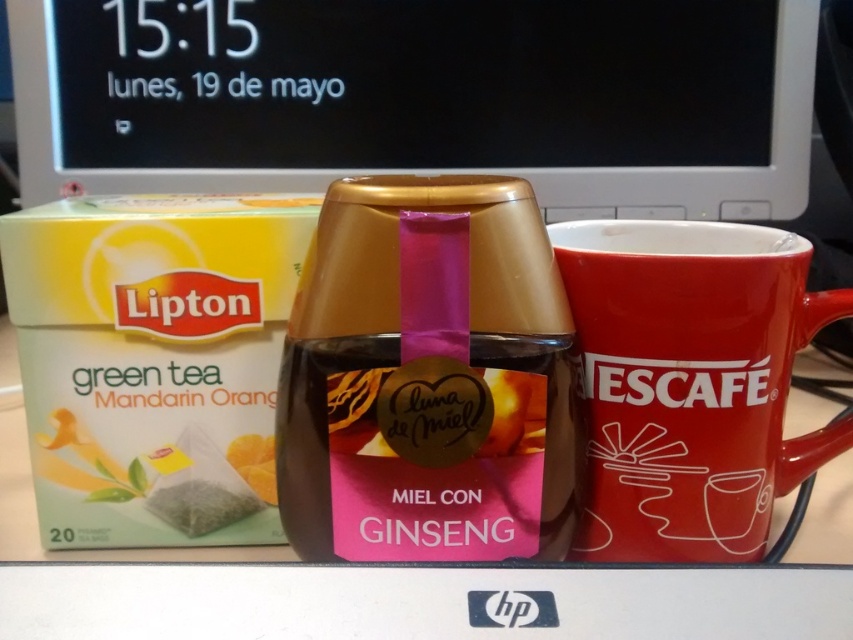
Does matte plastic laptop at upper center have a smaller size compared to pink glossy jar at center?

Answer: No.

Does point (624, 124) lie in front of point (374, 518)?

No, it is behind (374, 518).

Who is more forward, (316, 157) or (550, 305)?

Positioned in front is point (550, 305).

Find the location of a particular element. matte plastic laptop at upper center is located at coordinates (422, 97).

Is matte plastic laptop at upper center taller than red ceramic mug at center?

Correct, matte plastic laptop at upper center is much taller as red ceramic mug at center.

From the picture: Measure the distance from matte plastic laptop at upper center to red ceramic mug at center.

They are 20.40 inches apart.

Between point (27, 132) and point (769, 269), which one is positioned in front?

Point (769, 269) is in front.

I want to click on matte plastic laptop at upper center, so 422,97.

From the picture: Which is above, pink glossy jar at center or red ceramic mug at center?

red ceramic mug at center is above.

Measure the distance between point (x=450, y=269) and camera.

They are 15.33 inches apart.

Where is `pink glossy jar at center`? pink glossy jar at center is located at coordinates (427, 378).